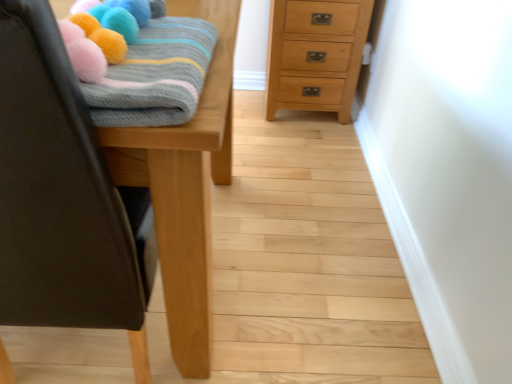
Locate an element on the screen. This screenshot has width=512, height=384. vacant point to the right of wooden table at left is located at coordinates (308, 255).